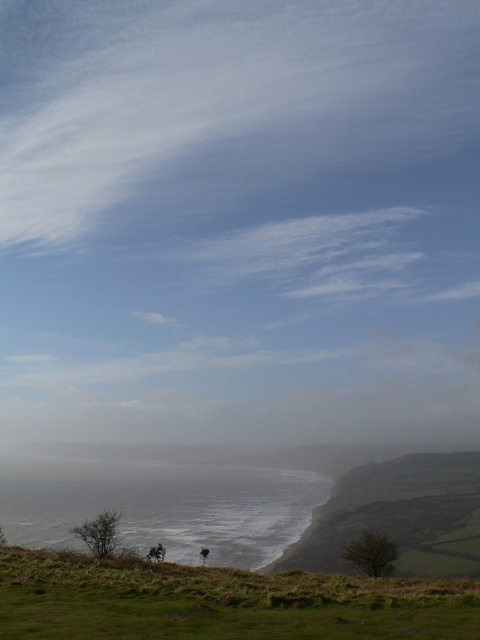
You are standing on the grassy hillside in the foreground of the image and want to estimate how far the white cotton cloud at upper center is from your current position. Based on the scene, can you provide an approximate distance?

The white cotton cloud at upper center is approximately 1984.50 feet away from the viewer.